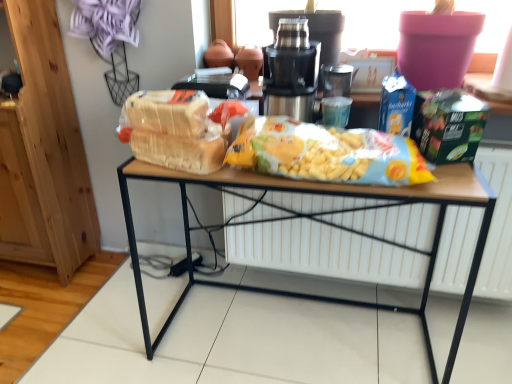
Question: Should I look upward or downward to see yellow matte cereal at center?

Choices:
 (A) up
 (B) down

Answer: (A)

Question: Would you consider white matte radiator at center to be distant from wooden table at center?

Choices:
 (A) yes
 (B) no

Answer: (B)

Question: Is white matte radiator at center wider than wooden table at center?

Choices:
 (A) yes
 (B) no

Answer: (B)

Question: Is white matte radiator at center outside wooden table at center?

Choices:
 (A) yes
 (B) no

Answer: (A)

Question: Considering the relative sizes of white matte radiator at center and wooden table at center in the image provided, is white matte radiator at center smaller than wooden table at center?

Choices:
 (A) yes
 (B) no

Answer: (A)

Question: Is white matte radiator at center to the left of wooden table at center from the viewer's perspective?

Choices:
 (A) no
 (B) yes

Answer: (A)

Question: Is white matte radiator at center at the right side of wooden table at center?

Choices:
 (A) no
 (B) yes

Answer: (B)

Question: Is wooden table at center outside white matte radiator at center?

Choices:
 (A) yes
 (B) no

Answer: (A)

Question: Does wooden table at center have a greater width compared to white matte radiator at center?

Choices:
 (A) no
 (B) yes

Answer: (B)

Question: Is wooden table at center further to the viewer compared to white matte radiator at center?

Choices:
 (A) no
 (B) yes

Answer: (A)

Question: From the image's perspective, would you say wooden table at center is positioned over white matte radiator at center?

Choices:
 (A) yes
 (B) no

Answer: (B)

Question: From a real-world perspective, is wooden table at center on white matte radiator at center?

Choices:
 (A) no
 (B) yes

Answer: (A)

Question: Is wooden table at center taller than white matte radiator at center?

Choices:
 (A) no
 (B) yes

Answer: (B)

Question: Could you tell me if metallic stainless steel juicer at center is facing white matte radiator at center?

Choices:
 (A) yes
 (B) no

Answer: (B)